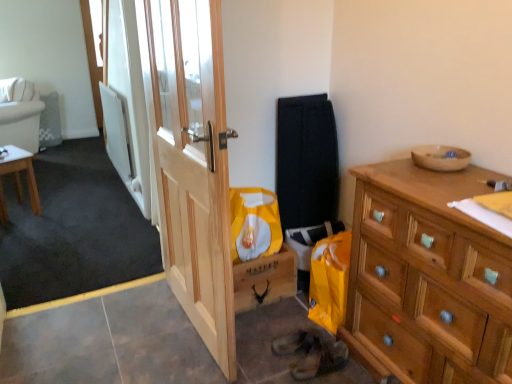
Question: Is white fabric couch at upper left outside wooden dresser at right?

Choices:
 (A) yes
 (B) no

Answer: (A)

Question: Are white fabric couch at upper left and wooden dresser at right far apart?

Choices:
 (A) no
 (B) yes

Answer: (B)

Question: Is white fabric couch at upper left taller than wooden dresser at right?

Choices:
 (A) yes
 (B) no

Answer: (A)

Question: Is white fabric couch at upper left at the right side of wooden dresser at right?

Choices:
 (A) yes
 (B) no

Answer: (B)

Question: Can you confirm if white fabric couch at upper left is smaller than wooden dresser at right?

Choices:
 (A) yes
 (B) no

Answer: (B)

Question: Does white fabric couch at upper left lie behind wooden dresser at right?

Choices:
 (A) no
 (B) yes

Answer: (B)

Question: Is wooden bowl at upper right at the left side of light brown wooden table at left?

Choices:
 (A) yes
 (B) no

Answer: (B)

Question: Does wooden bowl at upper right have a lesser width compared to light brown wooden table at left?

Choices:
 (A) yes
 (B) no

Answer: (A)

Question: Considering the relative sizes of wooden bowl at upper right and light brown wooden table at left in the image provided, is wooden bowl at upper right wider than light brown wooden table at left?

Choices:
 (A) yes
 (B) no

Answer: (B)

Question: Is wooden bowl at upper right behind light brown wooden table at left?

Choices:
 (A) no
 (B) yes

Answer: (A)

Question: Does wooden bowl at upper right appear on the right side of light brown wooden table at left?

Choices:
 (A) no
 (B) yes

Answer: (B)

Question: Is wooden bowl at upper right oriented towards light brown wooden table at left?

Choices:
 (A) yes
 (B) no

Answer: (B)

Question: Can we say light brown wooden table at left lies outside wooden bowl at upper right?

Choices:
 (A) yes
 (B) no

Answer: (A)